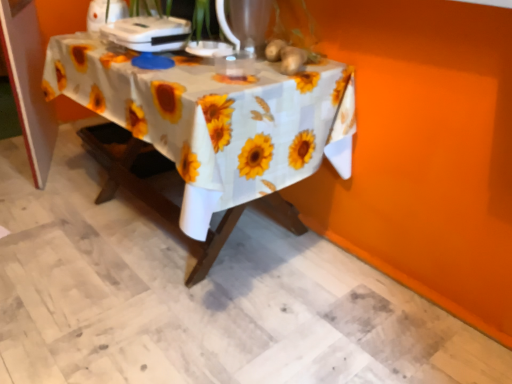
You are a GUI agent. You are given a task and a screenshot of the screen. Output one action in this format:
    pyautogui.click(x=<x>, y=<y>)
    Task: Click on the vacant space situated above white plastic appliance at upper center, placed as the 1th appliance when sorted from right to left (from a real-world perspective)
    This screenshot has width=512, height=384.
    Given the screenshot: What is the action you would take?
    pyautogui.click(x=153, y=20)